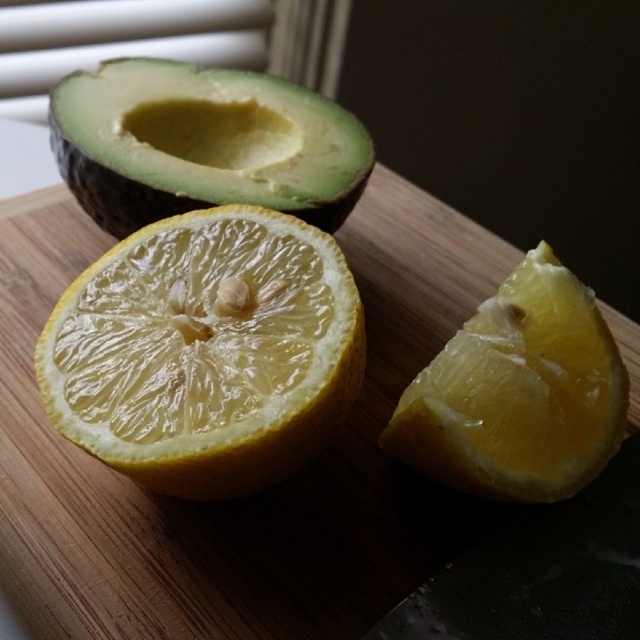
You are preparing a fruit salad and need to know which fruit is bigger. Which is bigger between the translucent yellow orange at center and the green matte avocado at upper left?

The translucent yellow orange at center is larger in size than the green matte avocado at upper left.

You are preparing a fruit salad and need to know where the translucent yellow orange at center is in relation to the wooden cutting board at center. Is the orange above or below the cutting board?

The wooden cutting board at center is located above the translucent yellow orange at center, so the orange is below the cutting board.

You are a chef preparing ingredients and need to place the green matte avocado at upper left closer to the wooden cutting board at center. Currently, how far apart are they?

The distance between the wooden cutting board at center and the green matte avocado at upper left is 9.88 inches.